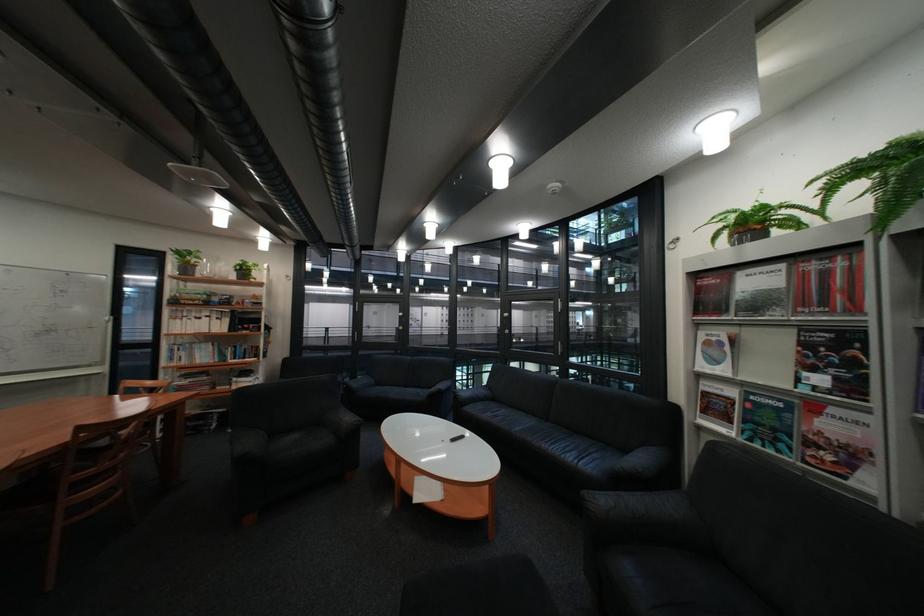
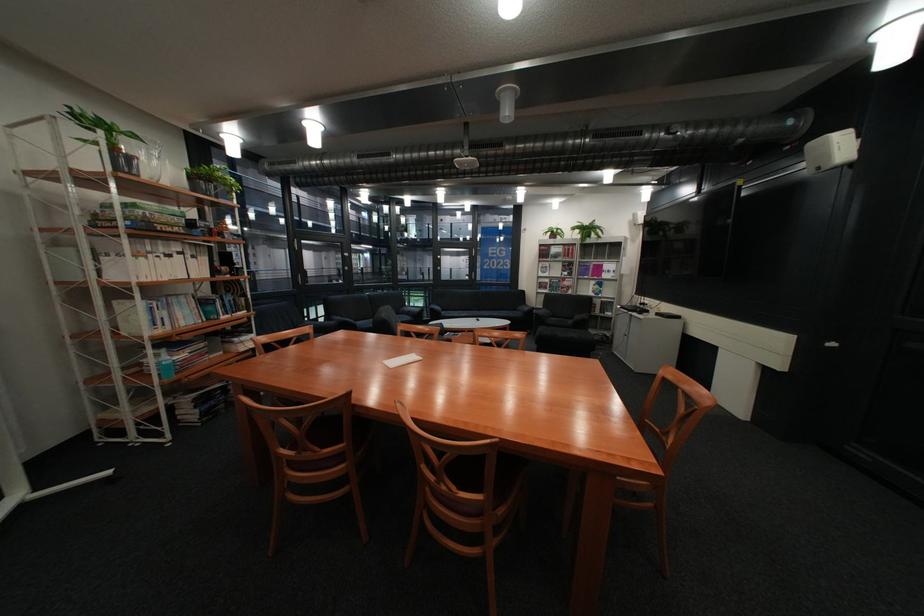
Where in the second image is the point corresponding to pixel 210 275 from the first image?

(152, 177)